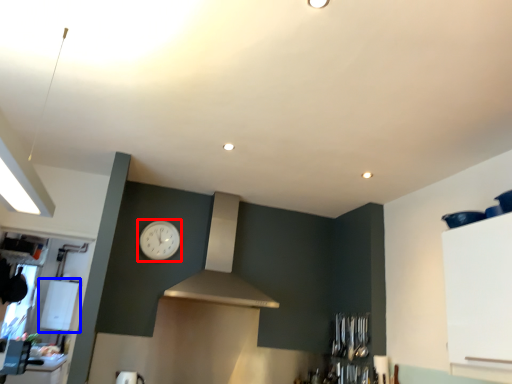
Question: Which object appears closest to the camera in this image, clock (highlighted by a red box) or appliance (highlighted by a blue box)?

Choices:
 (A) clock
 (B) appliance

Answer: (A)